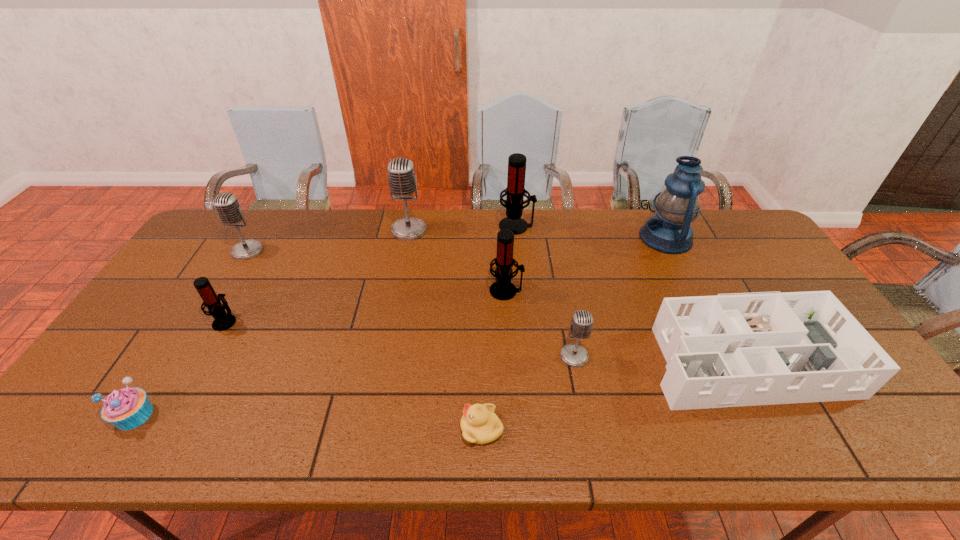
This screenshot has width=960, height=540. Find the location of `red microphone identified as the closest to the third microphone from left to right`. red microphone identified as the closest to the third microphone from left to right is located at coordinates (515, 191).

Where is `gray microphone that is the closest one to the second farthest red microphone`? This screenshot has height=540, width=960. gray microphone that is the closest one to the second farthest red microphone is located at coordinates (574, 355).

Point out which gray microphone is positioned as the nearest to the third shortest object. Please provide its 2D coordinates. Your answer should be formatted as a tuple, i.e. [(x, y)], where the tuple contains the x and y coordinates of a point satisfying the conditions above.

[(574, 355)]

Identify the location of free region that satisfies the following two spatial constraints: 1. on the face of the lantern; 2. on the left side of the third shortest object. (722, 352).

This screenshot has height=540, width=960. I want to click on free space in the image that satisfies the following two spatial constraints: 1. on the front side of the eighth tallest object; 2. on the left side of the biggest gray microphone, so click(x=385, y=352).